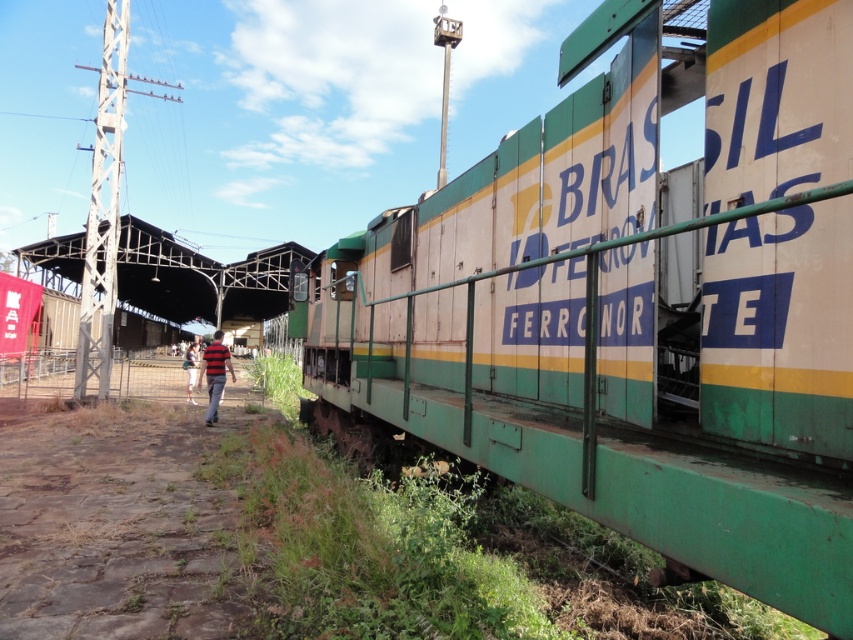
You are standing on the platform at the railway station and see the brown stone dirt track at lower left and the white cotton shirt at center. Which object is positioned more to the right from your viewpoint?

The brown stone dirt track at lower left is positioned to the right of the white cotton shirt at center, so the brown stone dirt track at lower left is more to the right.

You are a photographer standing on the platform and want to capture both the green painted metal train car at right and the white cotton shirt at center in the same frame. Which object should you position closer to the edge of your camera viewfinder to ensure both are included?

You should position the green painted metal train car at right closer to the right edge of your camera viewfinder since it is on the right side of the white cotton shirt at center, allowing both objects to be captured within the frame.